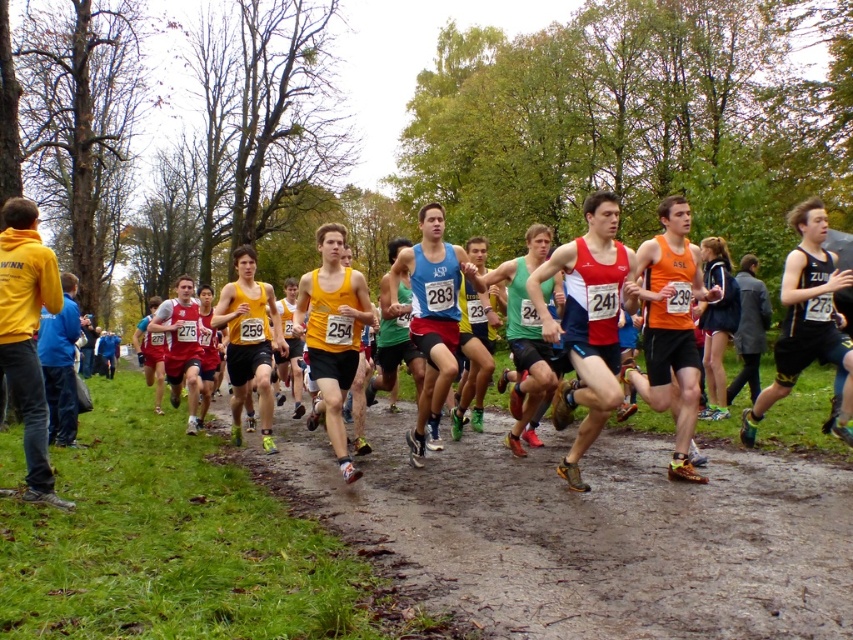
Does yellow hoodie at left lie in front of blue fabric tank top at center?

That is True.

Does yellow hoodie at left appear under blue fabric tank top at center?

Actually, yellow hoodie at left is above blue fabric tank top at center.

Between point (44, 500) and point (448, 298), which one is positioned behind?

The point (448, 298) is behind.

You are a GUI agent. You are given a task and a screenshot of the screen. Output one action in this format:
    pyautogui.click(x=<x>, y=<y>)
    Task: Click on the yellow hoodie at left
    Image resolution: width=853 pixels, height=640 pixels.
    Given the screenshot: What is the action you would take?
    pyautogui.click(x=27, y=337)

Can you confirm if blue fabric jacket at left is positioned to the right of matte red tank top at center?

Incorrect, blue fabric jacket at left is not on the right side of matte red tank top at center.

Which is more to the left, blue fabric jacket at left or matte red tank top at center?

From the viewer's perspective, blue fabric jacket at left appears more on the left side.

Consider the image. Who is more distant from viewer, (73, 396) or (164, 355)?

The point (164, 355) is behind.

This screenshot has height=640, width=853. What are the coordinates of `blue fabric jacket at left` in the screenshot? It's located at (61, 364).

Does yellow hoodie at left have a greater width compared to blue fabric jacket at left?

Yes, yellow hoodie at left is wider than blue fabric jacket at left.

I want to click on yellow hoodie at left, so click(x=27, y=337).